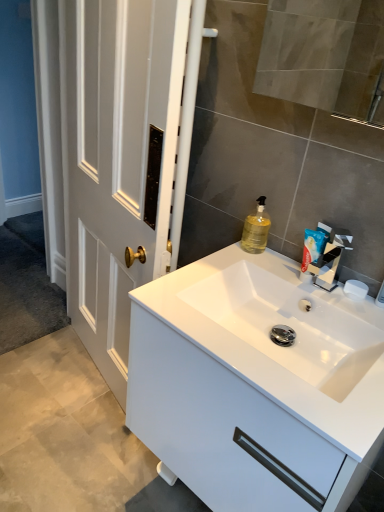
Question: From the image's perspective, is white matte soap at right on top of translucent yellow liquid at sink right?

Choices:
 (A) no
 (B) yes

Answer: (A)

Question: Is white matte soap at right at the right side of translucent yellow liquid at sink right?

Choices:
 (A) yes
 (B) no

Answer: (A)

Question: Can you confirm if white matte soap at right is smaller than translucent yellow liquid at sink right?

Choices:
 (A) yes
 (B) no

Answer: (A)

Question: Does white matte soap at right have a greater height compared to translucent yellow liquid at sink right?

Choices:
 (A) no
 (B) yes

Answer: (A)

Question: Is white matte soap at right facing towards translucent yellow liquid at sink right?

Choices:
 (A) yes
 (B) no

Answer: (B)

Question: Looking at the image, does white glossy cabinet at center seem bigger or smaller compared to white plastic toothpaste tube at upper right?

Choices:
 (A) small
 (B) big

Answer: (B)

Question: Does point (241, 312) appear closer or farther from the camera than point (311, 236)?

Choices:
 (A) closer
 (B) farther

Answer: (A)

Question: Relative to white plastic toothpaste tube at upper right, is white glossy cabinet at center in front or behind?

Choices:
 (A) front
 (B) behind

Answer: (A)

Question: Would you say white glossy cabinet at center is to the left or to the right of white plastic toothpaste tube at upper right in the picture?

Choices:
 (A) left
 (B) right

Answer: (A)

Question: Considering the positions of translucent yellow liquid at sink right and white matte soap at right in the image, is translucent yellow liquid at sink right bigger or smaller than white matte soap at right?

Choices:
 (A) big
 (B) small

Answer: (A)

Question: Is point (251, 226) closer or farther from the camera than point (360, 287)?

Choices:
 (A) closer
 (B) farther

Answer: (B)

Question: Relative to white matte soap at right, is translucent yellow liquid at sink right in front or behind?

Choices:
 (A) front
 (B) behind

Answer: (B)

Question: Is translucent yellow liquid at sink right spatially inside white matte soap at right, or outside of it?

Choices:
 (A) inside
 (B) outside

Answer: (B)

Question: In terms of height, does silver metallic tap at upper right look taller or shorter compared to translucent yellow liquid at sink right?

Choices:
 (A) tall
 (B) short

Answer: (A)

Question: From a real-world perspective, is silver metallic tap at upper right physically located above or below translucent yellow liquid at sink right?

Choices:
 (A) above
 (B) below

Answer: (B)